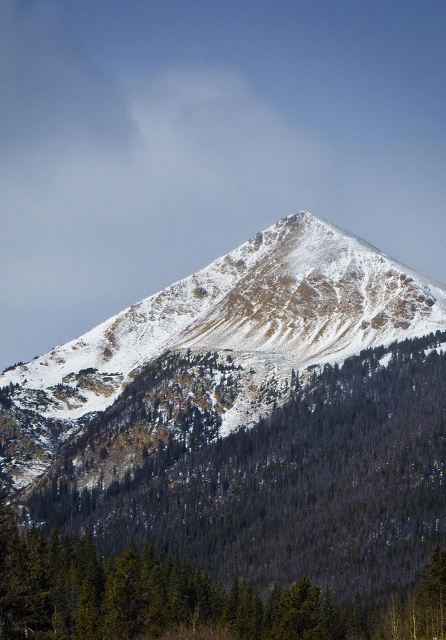
Question: Which point is farther to the camera?

Choices:
 (A) green textured tree at center
 (B) snowy rocky peak at center

Answer: (B)

Question: Where is green textured tree at center located in relation to snowy rocky peak at center in the image?

Choices:
 (A) left
 (B) right

Answer: (A)

Question: Does green textured tree at center have a larger size compared to snowy rocky peak at center?

Choices:
 (A) no
 (B) yes

Answer: (B)

Question: Can you confirm if green textured tree at center is smaller than snowy rocky peak at center?

Choices:
 (A) yes
 (B) no

Answer: (B)